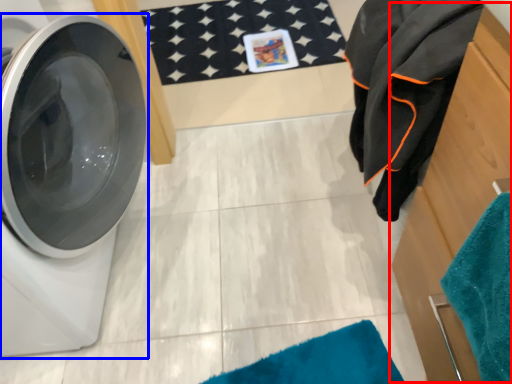
Question: Which object is closer to the camera taking this photo, dresser (highlighted by a red box) or washing machine (highlighted by a blue box)?

Choices:
 (A) dresser
 (B) washing machine

Answer: (A)